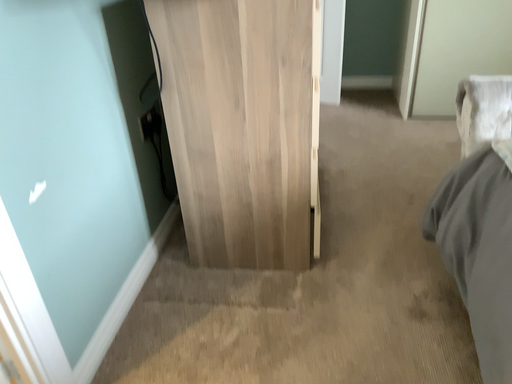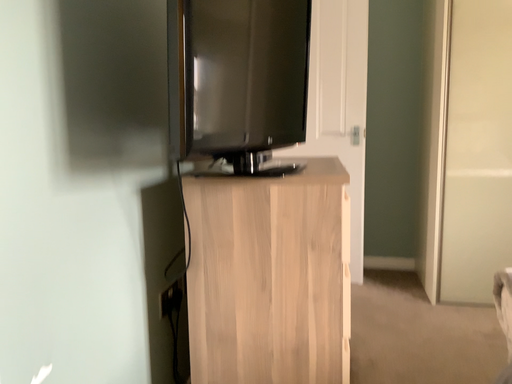
Question: Which way did the camera rotate in the video?

Choices:
 (A) rotated upward
 (B) rotated downward

Answer: (A)